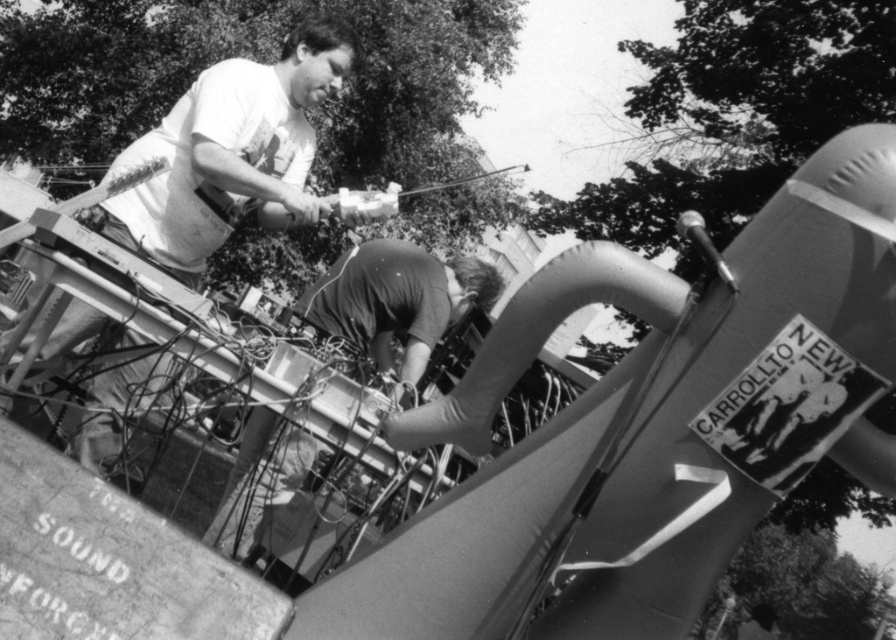
Who is shorter, white t-shirt at upper left or smooth dark fabric skateboard at center?

Standing shorter between the two is smooth dark fabric skateboard at center.

Where is `white t-shirt at upper left`? white t-shirt at upper left is located at coordinates (231, 154).

The height and width of the screenshot is (640, 896). In order to click on white t-shirt at upper left in this screenshot , I will do `click(231, 154)`.